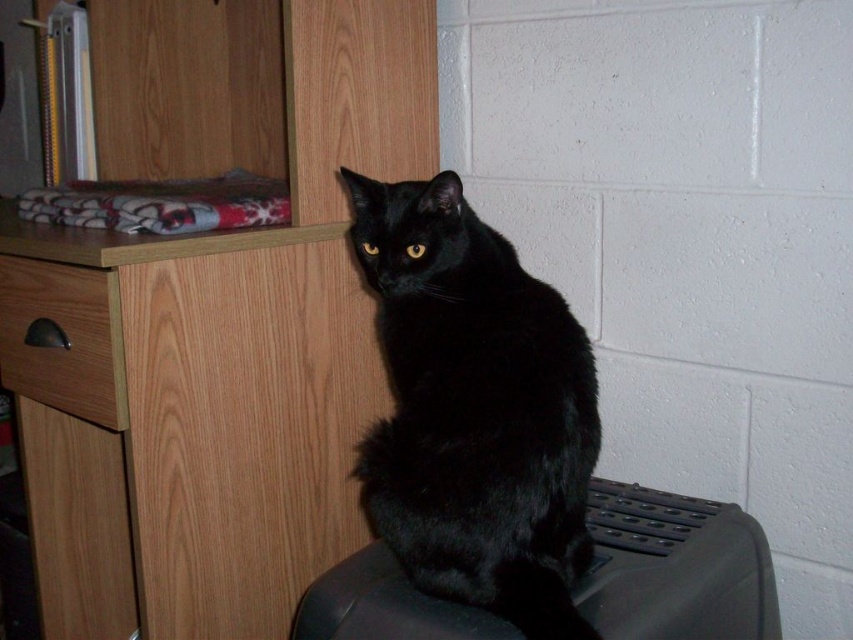
Which is behind, point (117, 458) or point (96, 416)?

Positioned behind is point (117, 458).

Between wooden cabinet at upper left and brushed wood drawer at left, which one appears on the right side from the viewer's perspective?

From the viewer's perspective, wooden cabinet at upper left appears more on the right side.

Image resolution: width=853 pixels, height=640 pixels. Find the location of `wooden cabinet at upper left`. wooden cabinet at upper left is located at coordinates (212, 317).

Based on the photo, is black fur cat at center wider than brushed wood drawer at left?

Yes, black fur cat at center is wider than brushed wood drawer at left.

Can you confirm if black fur cat at center is positioned to the left of brushed wood drawer at left?

Incorrect, black fur cat at center is not on the left side of brushed wood drawer at left.

Is point (440, 381) positioned after point (73, 310)?

No, (440, 381) is closer to viewer.

This screenshot has height=640, width=853. Identify the location of black fur cat at center. pyautogui.click(x=474, y=410).

Can you confirm if black fur cat at center is positioned to the right of black plastic swivel chair at lower right?

Incorrect, black fur cat at center is not on the right side of black plastic swivel chair at lower right.

What do you see at coordinates (474, 410) in the screenshot? This screenshot has height=640, width=853. I see `black fur cat at center` at bounding box center [474, 410].

Image resolution: width=853 pixels, height=640 pixels. In order to click on black fur cat at center in this screenshot , I will do `click(474, 410)`.